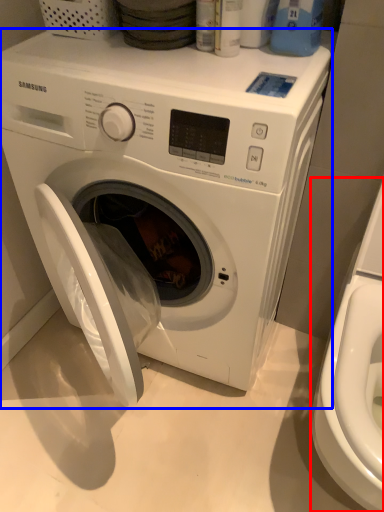
Question: Which of the following is the closest to the observer, washer (highlighted by a red box) or washing machine (highlighted by a blue box)?

Choices:
 (A) washer
 (B) washing machine

Answer: (A)